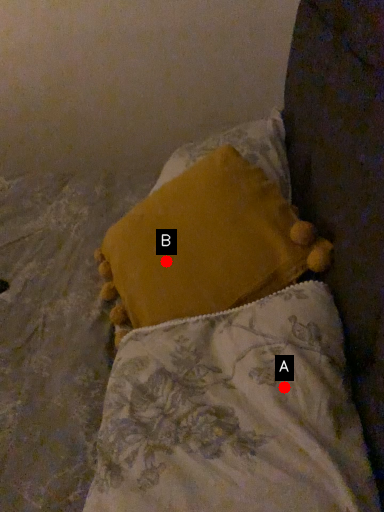
Question: Two points are circled on the image, labeled by A and B beside each circle. Among these points, which one is farthest from the camera?

Choices:
 (A) A is further
 (B) B is further

Answer: (B)